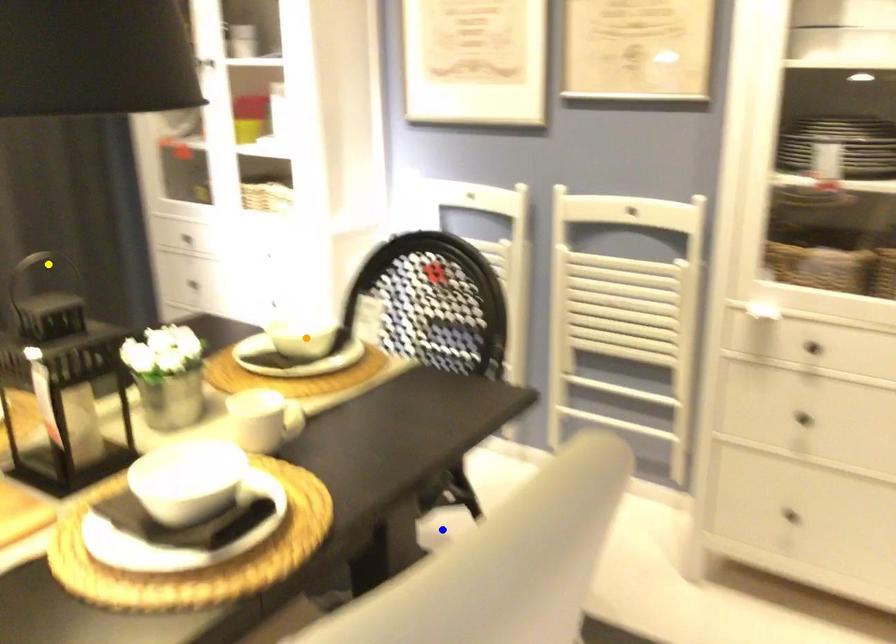
Order these from farthest to nearest:
1. orange point
2. blue point
3. yellow point

yellow point < orange point < blue point